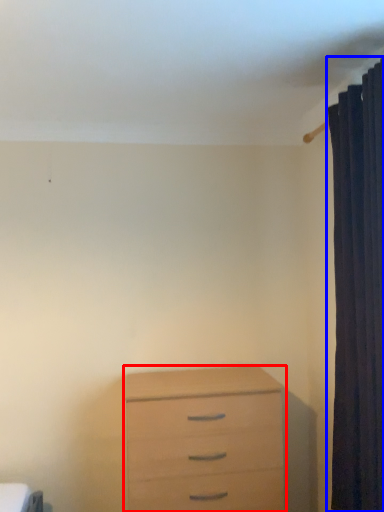
Question: Which point is closer to the camera, chest of drawers (highlighted by a red box) or curtain (highlighted by a blue box)?

Choices:
 (A) chest of drawers
 (B) curtain

Answer: (B)